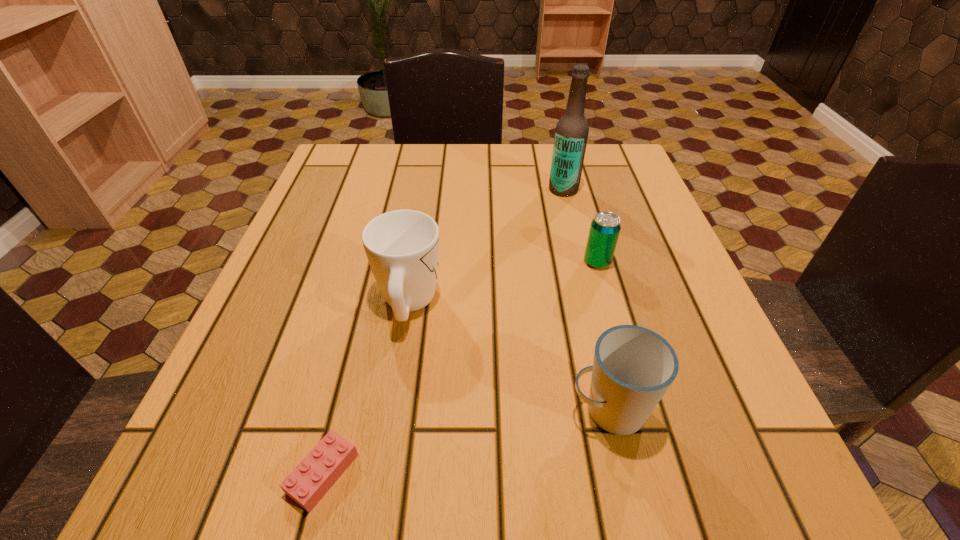
Locate an element on the screen. The image size is (960, 540). Lego that is at the near edge is located at coordinates (311, 479).

Identify the location of object present at the left edge. (311, 479).

Locate an element on the screen. beer bottle that is at the right edge is located at coordinates (571, 134).

Locate an element on the screen. Image resolution: width=960 pixels, height=540 pixels. cup positioned at the right edge is located at coordinates (633, 367).

Identify the location of beer can that is at the right edge. (604, 231).

The height and width of the screenshot is (540, 960). What are the coordinates of `object present at the near left corner` in the screenshot? It's located at (311, 479).

You are a GUI agent. You are given a task and a screenshot of the screen. Output one action in this format:
    pyautogui.click(x=<x>, y=<y>)
    Task: Click on the object that is at the far right corner
    The image size is (960, 540).
    Given the screenshot: What is the action you would take?
    pyautogui.click(x=571, y=134)

You are a GUI agent. You are given a task and a screenshot of the screen. Output one action in this format:
    pyautogui.click(x=<x>, y=<y>)
    Task: Click on the object present at the near right corner
    This screenshot has height=540, width=960.
    Given the screenshot: What is the action you would take?
    pyautogui.click(x=633, y=367)

Find the location of a particular element. vacant space at the far edge of the desktop is located at coordinates (478, 171).

Where is `free location at the near edge of the desktop`? This screenshot has height=540, width=960. free location at the near edge of the desktop is located at coordinates (540, 497).